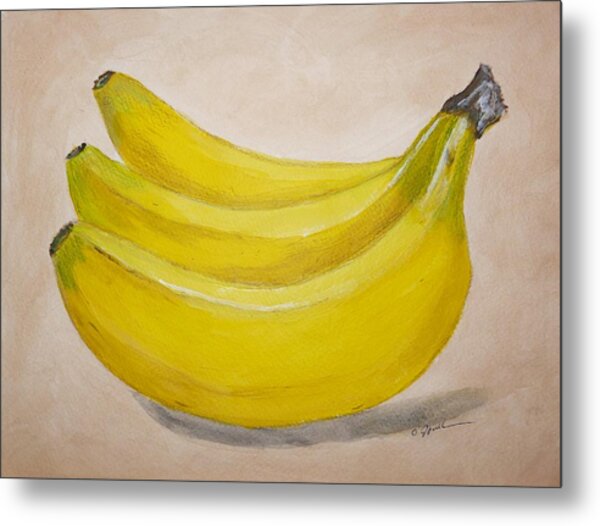
Identify the location of painting. (526, 356).